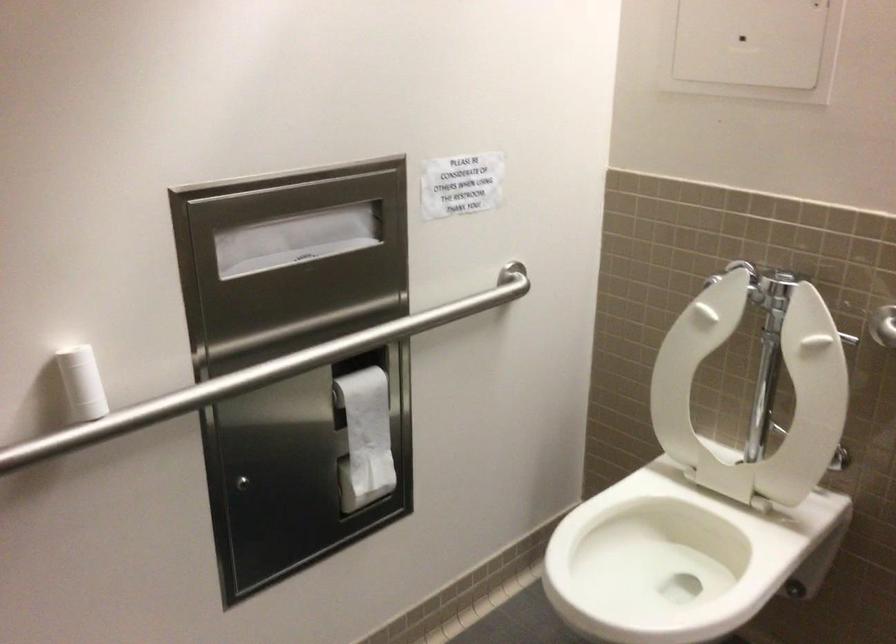
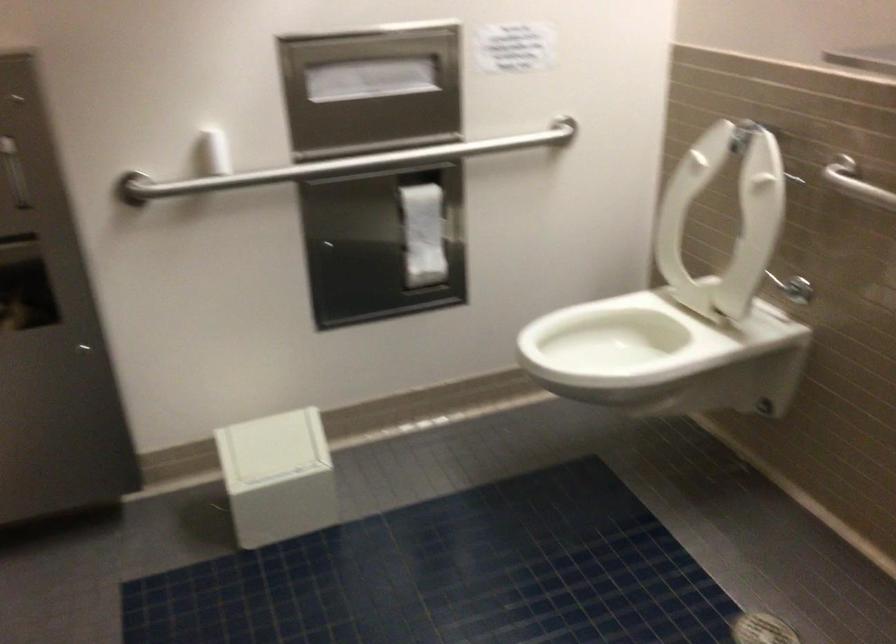
The point at (281, 373) is marked in the first image. Where is the corresponding point in the second image?

(343, 165)